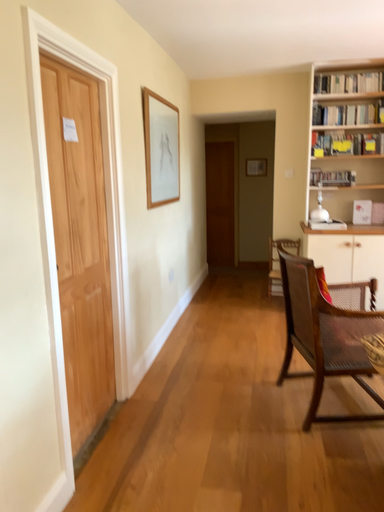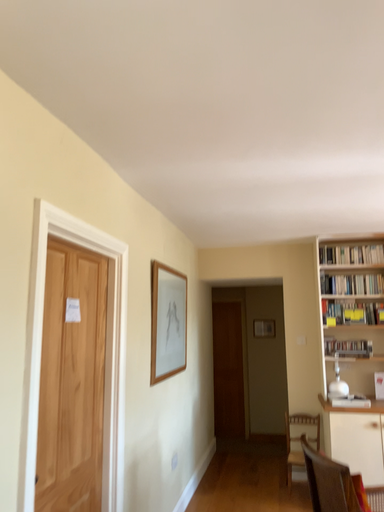
Question: How did the camera likely rotate when shooting the video?

Choices:
 (A) rotated downward
 (B) rotated upward

Answer: (B)